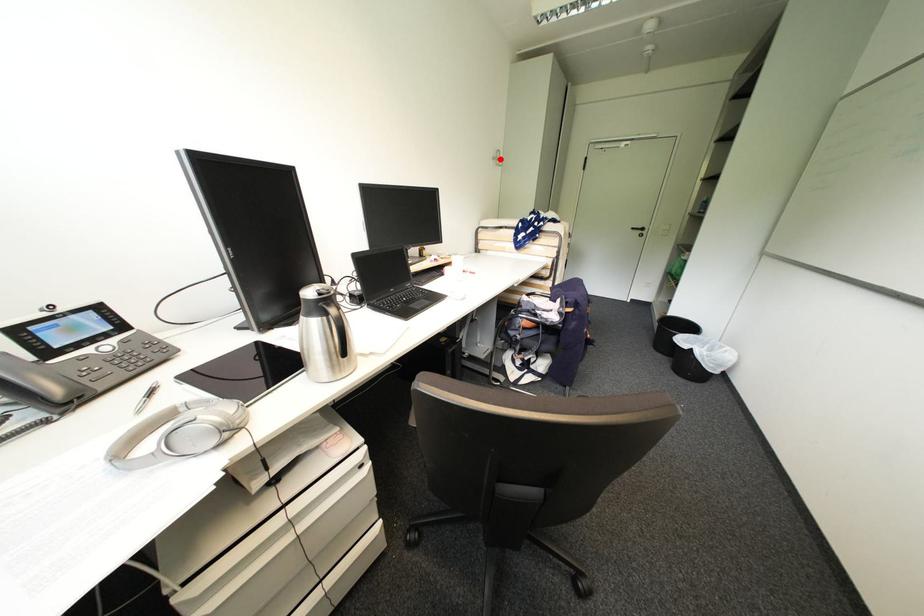
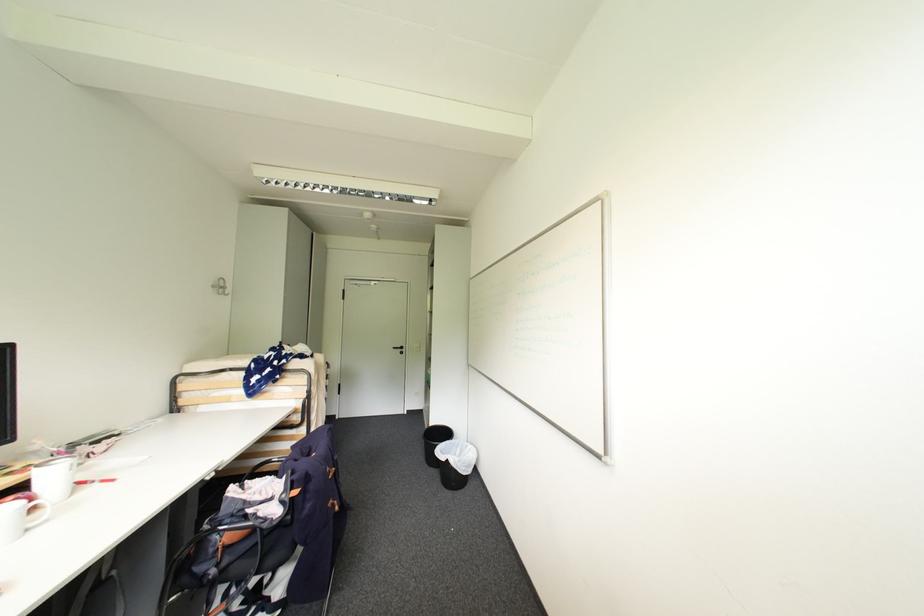
Where in the second image is the point corresponding to the highlighted location from the first image?

(220, 286)